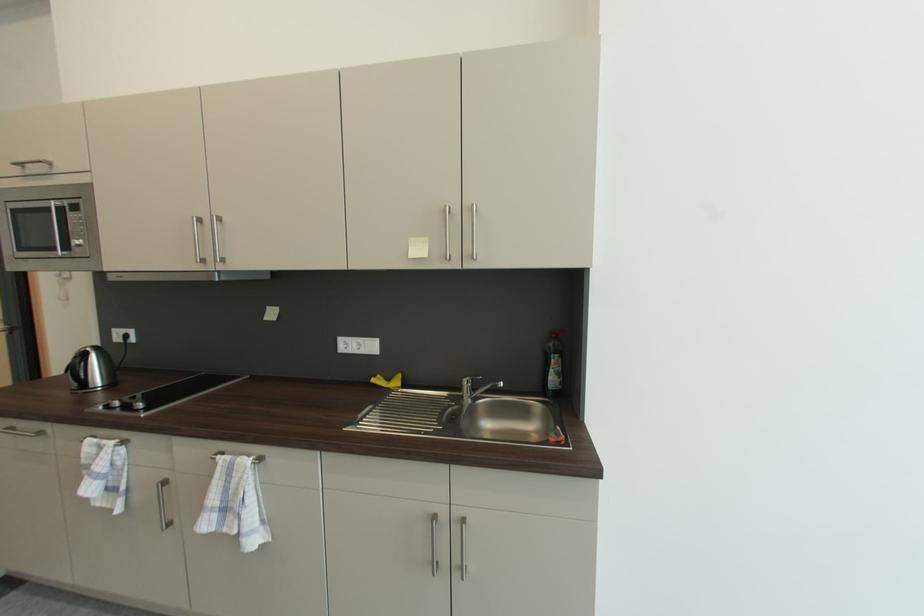
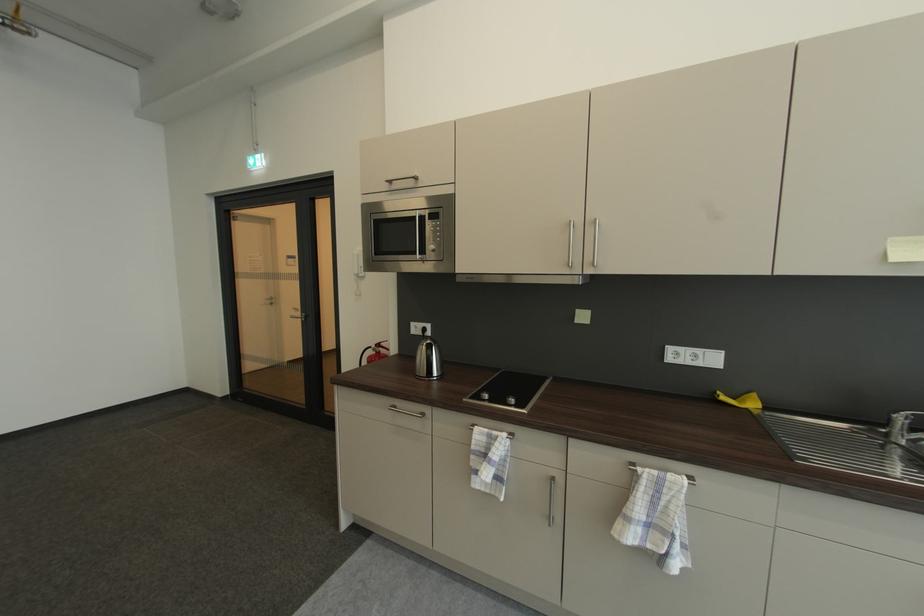
Locate, in the second image, the point that corresponds to [76,207] in the first image.

(436, 215)